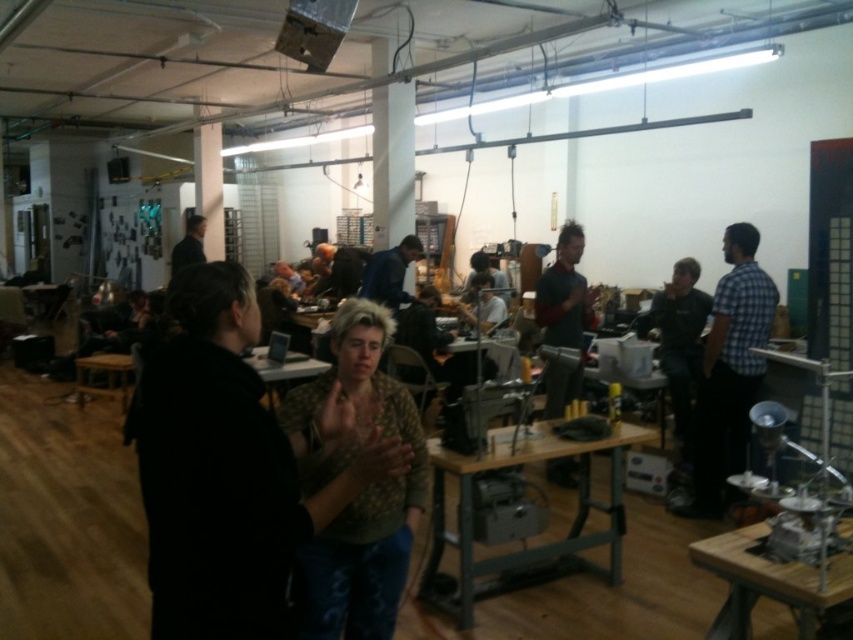
Describe the element at coordinates (767, 580) in the screenshot. I see `wooden at center` at that location.

Does wooden at center have a smaller size compared to dark blue shirt at center?

Correct, wooden at center occupies less space than dark blue shirt at center.

Which is behind, point (756, 522) or point (573, 224)?

The point (573, 224) is more distant.

Locate an element on the screen. The height and width of the screenshot is (640, 853). wooden at center is located at coordinates (767, 580).

Is point (460, 312) farther from camera compared to point (474, 272)?

No, (460, 312) is in front of (474, 272).

Does point (468, 284) come in front of point (473, 256)?

Yes, point (468, 284) is closer to viewer.

In order to click on matte black shirt at center in this screenshot , I will do `click(480, 304)`.

Between green textured shirt at center and camouflage-patterned shirt at center, which one appears on the left side from the viewer's perspective?

From the viewer's perspective, green textured shirt at center appears more on the left side.

Is point (329, 426) positioned behind point (364, 419)?

No, it is in front of (364, 419).

I want to click on green textured shirt at center, so click(225, 468).